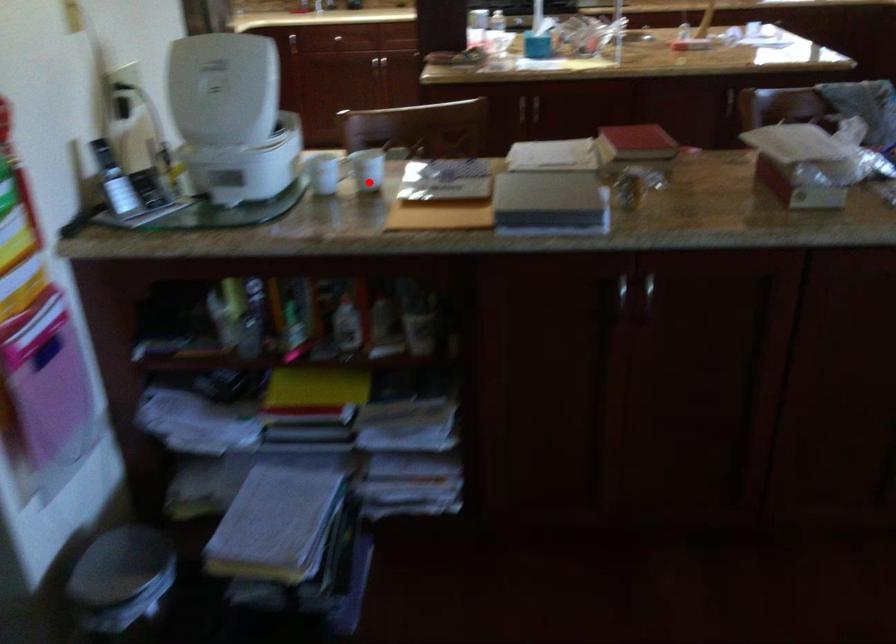
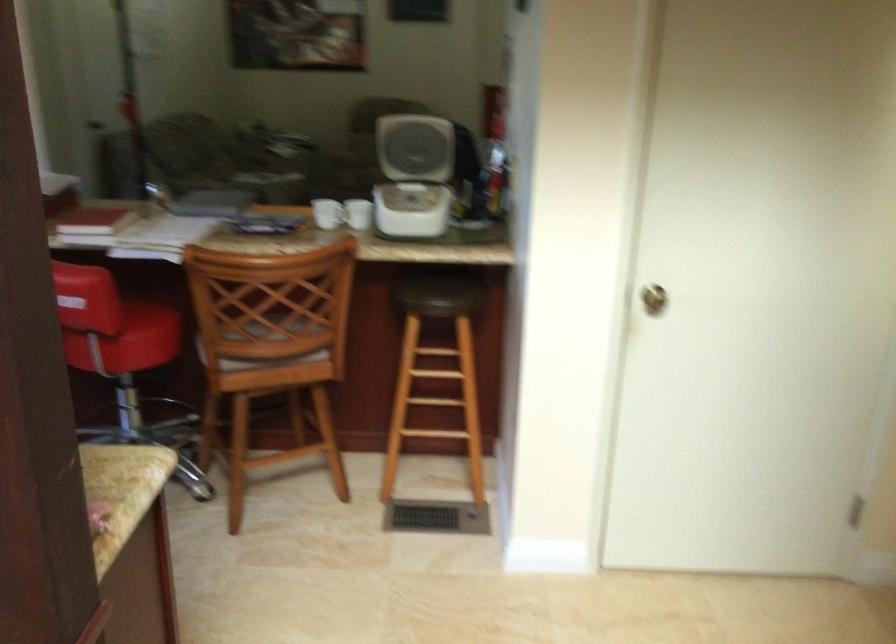
Question: A red point is marked in image1. In image2, is the corresponding 3D point closer to the camera or farther? Reply with the corresponding letter.

Choices:
 (A) The corresponding 3D point is closer.
 (B) The corresponding 3D point is farther.

Answer: (B)